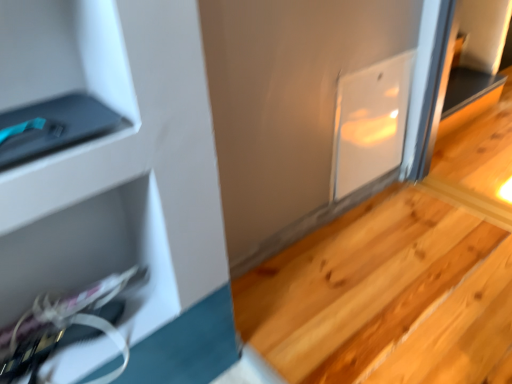
This screenshot has height=384, width=512. I want to click on free spot above white glossy scissors at lower left (from a real-world perspective), so click(69, 335).